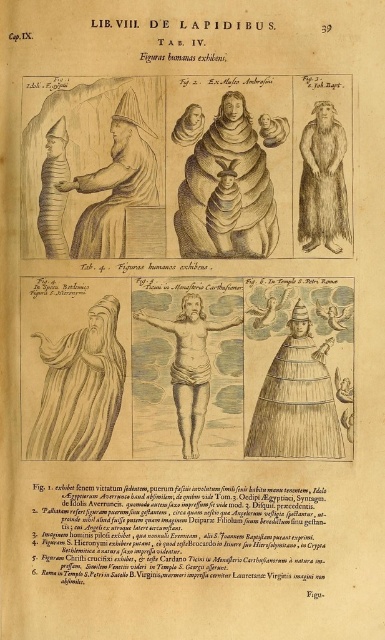
Based on the scene described in the historical book page from Lib. VIII. De Lapidibus, Tab. IV, Cap. IX, which shows six figures including a wooden statue at left and a smooth skin figure at center, which of these two figures has a narrower width?

The wooden statue at left is thinner than the smooth skin figure at center, so the wooden statue at left has a narrower width.